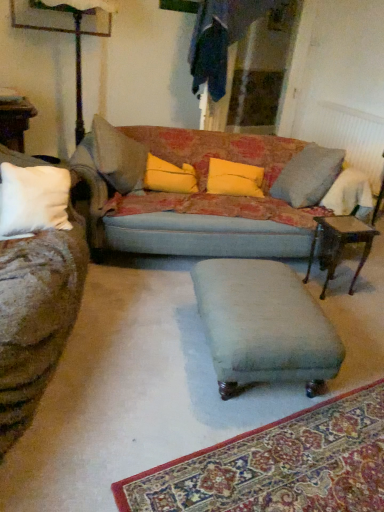
Locate an element on the screen. empty space that is ontop of wooden side table at right (from a real-world perspective) is located at coordinates (352, 220).